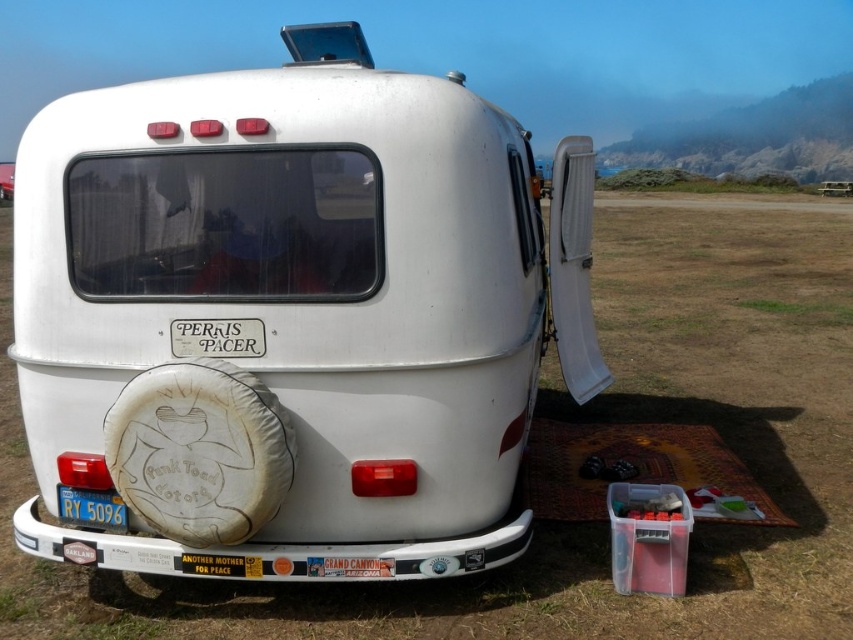
Question: Which object is closer to the camera taking this photo?

Choices:
 (A) blue metallic license plate at lower left
 (B) white fabric tire at rear

Answer: (B)

Question: Does white matte recreational vehicle at center have a greater width compared to blue metallic license plate at lower left?

Choices:
 (A) yes
 (B) no

Answer: (A)

Question: Does white matte recreational vehicle at center appear under white fabric tire at rear?

Choices:
 (A) no
 (B) yes

Answer: (A)

Question: Can you confirm if white matte recreational vehicle at center is positioned to the right of white fabric tire at rear?

Choices:
 (A) yes
 (B) no

Answer: (A)

Question: Among these points, which one is nearest to the camera?

Choices:
 (A) (360, 442)
 (B) (122, 476)

Answer: (B)

Question: Among these points, which one is nearest to the camera?

Choices:
 (A) (158, 388)
 (B) (177, 268)

Answer: (A)